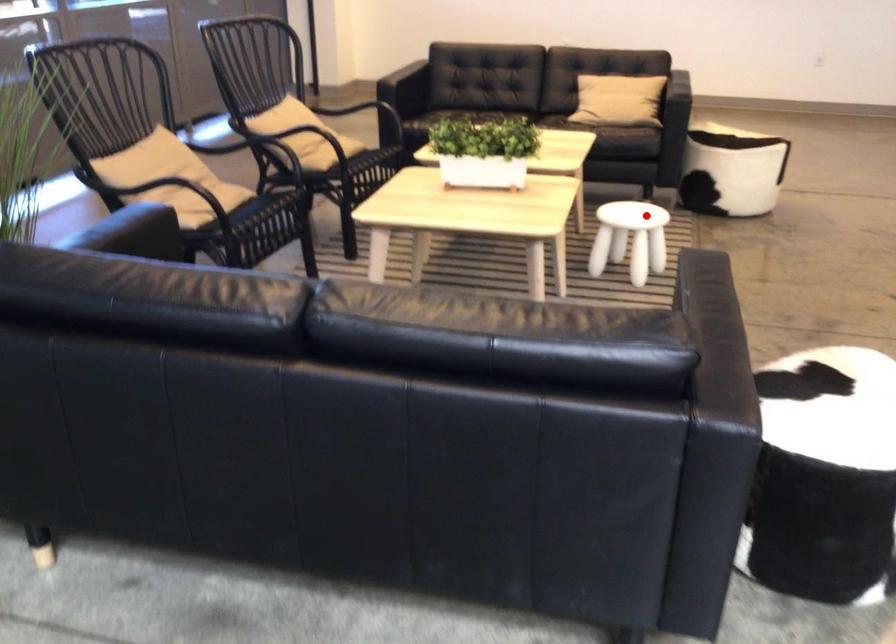
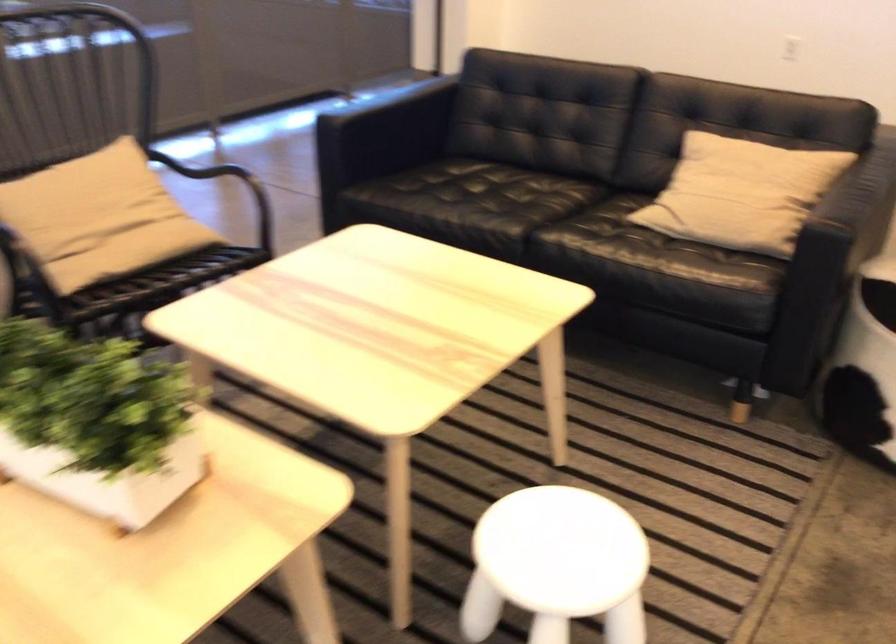
Question: I am providing you with two images of the same scene from different viewpoints. A red point is shown in image1. For the corresponding object point in image2, is it positioned nearer or farther from the camera?

Choices:
 (A) Nearer
 (B) Farther

Answer: (A)